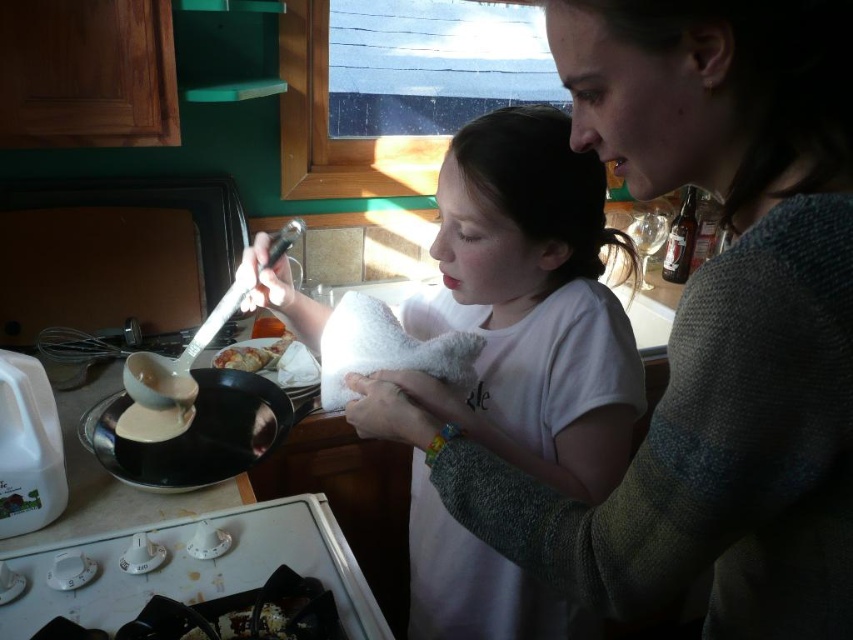
Who is lower down, white glossy stove at lower left or slightly browned crispy chicken at center?

white glossy stove at lower left

Is white glossy stove at lower left to the left of slightly browned crispy chicken at center from the viewer's perspective?

No, white glossy stove at lower left is not to the left of slightly browned crispy chicken at center.

What do you see at coordinates (196, 568) in the screenshot? Image resolution: width=853 pixels, height=640 pixels. I see `white glossy stove at lower left` at bounding box center [196, 568].

This screenshot has height=640, width=853. Identify the location of white glossy stove at lower left. coord(196,568).

Can you confirm if white soft towel at center is thinner than slightly browned crispy chicken at center?

In fact, white soft towel at center might be wider than slightly browned crispy chicken at center.

Is point (608, 301) less distant than point (247, 365)?

Yes, point (608, 301) is closer to viewer.

Between point (415, 566) and point (289, 340), which one is positioned behind?

Point (289, 340)

You are a GUI agent. You are given a task and a screenshot of the screen. Output one action in this format:
    pyautogui.click(x=<x>, y=<y>)
    Task: Click on the white soft towel at center
    The image size is (853, 640).
    Given the screenshot: What is the action you would take?
    pyautogui.click(x=531, y=304)

Who is more forward, (817, 355) or (170, 593)?

Point (817, 355) is more forward.

Which is behind, point (827, 243) or point (107, 550)?

The point (107, 550) is more distant.

Between point (799, 108) and point (310, 502), which one is positioned in front?

Point (799, 108) is more forward.

Find the location of `knitted gray sweater at upper right`. knitted gray sweater at upper right is located at coordinates tap(704, 326).